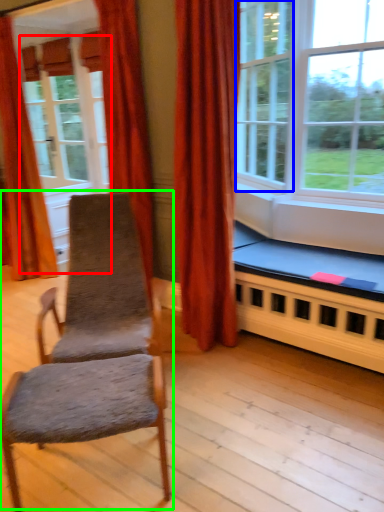
Question: Estimate the real-world distances between objects in this image. Which object is farther from screen door (highlighted by a red box), window (highlighted by a blue box) or rocking chair (highlighted by a green box)?

Choices:
 (A) window
 (B) rocking chair

Answer: (B)